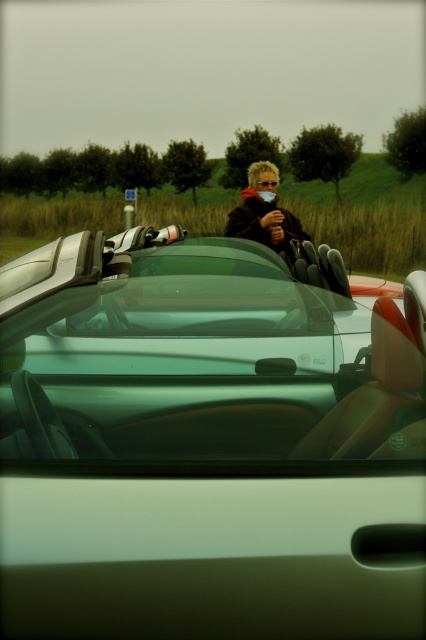
Does matte black jacket at center have a greater width compared to translucent orange goggles at center?

Yes, matte black jacket at center is wider than translucent orange goggles at center.

The width and height of the screenshot is (426, 640). Describe the element at coordinates (264, 214) in the screenshot. I see `matte black jacket at center` at that location.

Identify the location of matte black jacket at center. (264, 214).

Where is `metallic silver convertible at center`? metallic silver convertible at center is located at coordinates (206, 445).

Between metallic silver convertible at center and translucent orange goggles at center, which one appears on the left side from the viewer's perspective?

metallic silver convertible at center is more to the left.

Is point (189, 396) behind point (265, 186)?

No, it is in front of (265, 186).

Locate an element on the screen. The height and width of the screenshot is (640, 426). metallic silver convertible at center is located at coordinates (206, 445).

Between point (313, 627) and point (270, 202), which one is positioned behind?

Point (270, 202)

In the scene shown: Is metallic silver convertible at center above matte black jacket at center?

Actually, metallic silver convertible at center is below matte black jacket at center.

The image size is (426, 640). Describe the element at coordinates (206, 445) in the screenshot. I see `metallic silver convertible at center` at that location.

Identify the location of metallic silver convertible at center. (206, 445).